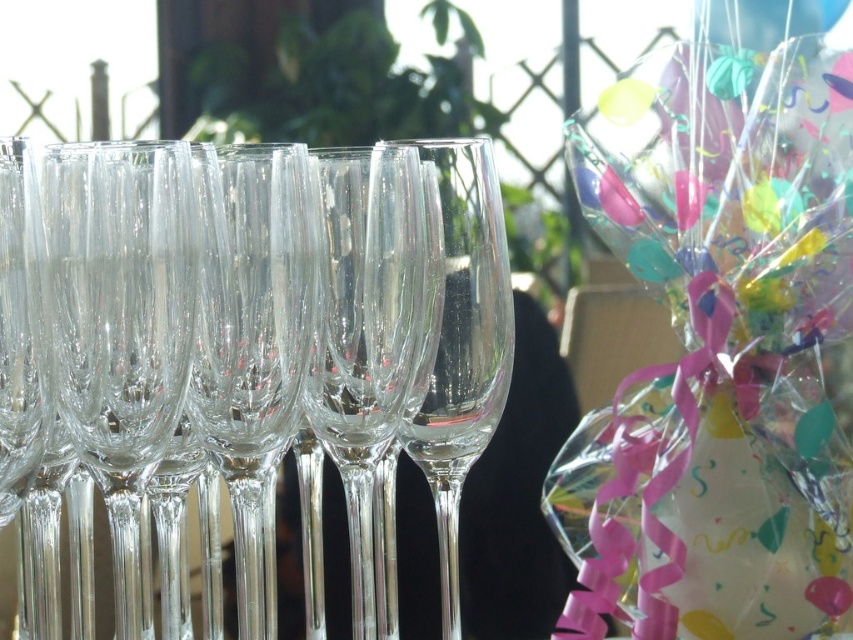
Question: Which of the following is the farthest from the observer?

Choices:
 (A) (338, 216)
 (B) (450, 429)

Answer: (B)

Question: Does transparent crystal wine glass at center have a greater width compared to transparent glass wine glass at center?

Choices:
 (A) no
 (B) yes

Answer: (B)

Question: Which point is closer to the camera taking this photo?

Choices:
 (A) (457, 246)
 (B) (416, 410)
 (C) (625, 410)

Answer: (A)

Question: Can you confirm if transparent crystal wine glass at left is positioned below transparent crystal wine glass at center?

Choices:
 (A) no
 (B) yes

Answer: (A)

Question: Which point is farther from the camera taking this photo?

Choices:
 (A) (415, 394)
 (B) (838, 481)
 (C) (292, 280)

Answer: (A)

Question: Where is transparent crystal wine glass at left located in relation to transparent glass wine glass at center in the image?

Choices:
 (A) right
 (B) left

Answer: (B)